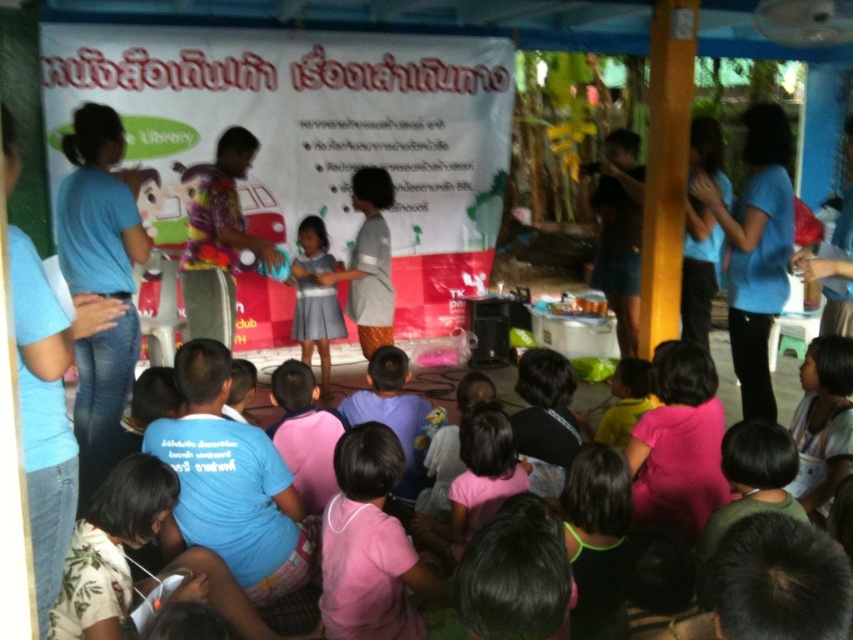
Which of these two, pink matte shirt at lower center or matte gray dress at center, stands taller?

matte gray dress at center is taller.

Find the location of a particular element. Image resolution: width=853 pixels, height=640 pixels. pink matte shirt at lower center is located at coordinates (370, 545).

Is point (224, 301) closer to camera compared to point (344, 328)?

Yes, point (224, 301) is closer to viewer.

Can you confirm if floral fabric shirt at center is thinner than matte gray dress at center?

No.

Which is in front, point (190, 320) or point (328, 344)?

Point (190, 320) is more forward.

The image size is (853, 640). In order to click on floral fabric shirt at center in this screenshot , I will do `click(219, 241)`.

Does pink matte shirt at lower center have a lesser height compared to floral fabric shirt at center?

Yes, pink matte shirt at lower center is shorter than floral fabric shirt at center.

Between pink matte shirt at lower center and floral fabric shirt at center, which one is positioned higher?

floral fabric shirt at center is higher up.

You are a GUI agent. You are given a task and a screenshot of the screen. Output one action in this format:
    pyautogui.click(x=<x>, y=<y>)
    Task: Click on the pink matte shirt at lower center
    This screenshot has width=853, height=640.
    Given the screenshot: What is the action you would take?
    pyautogui.click(x=370, y=545)

This screenshot has height=640, width=853. What are the coordinates of `pink matte shirt at lower center` in the screenshot? It's located at (370, 545).